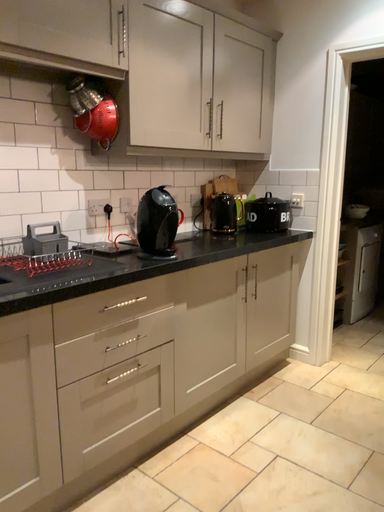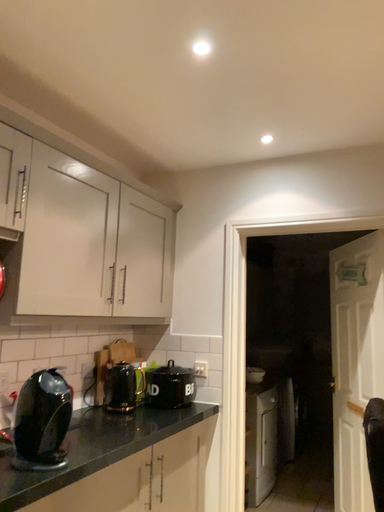
Question: How did the camera likely rotate when shooting the video?

Choices:
 (A) rotated upward
 (B) rotated downward

Answer: (A)